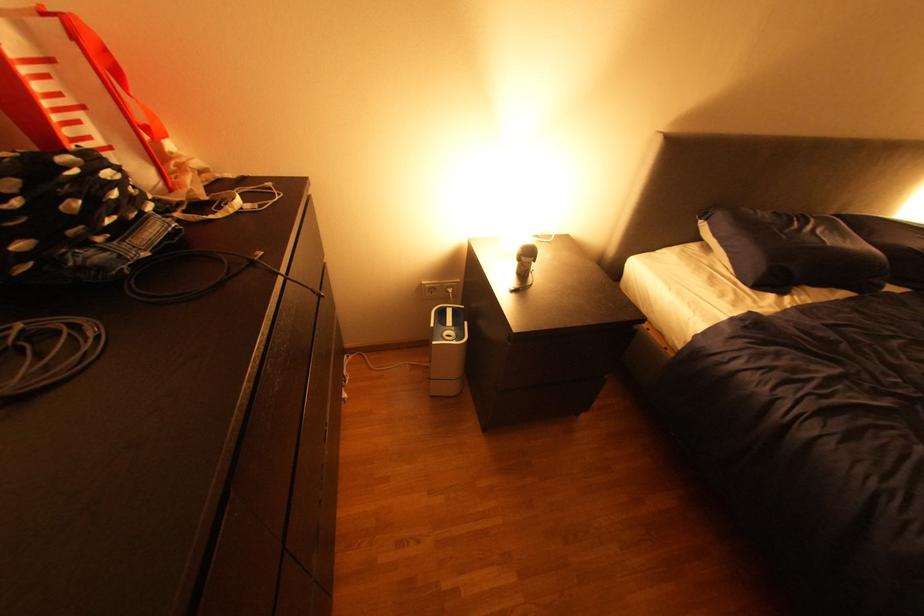
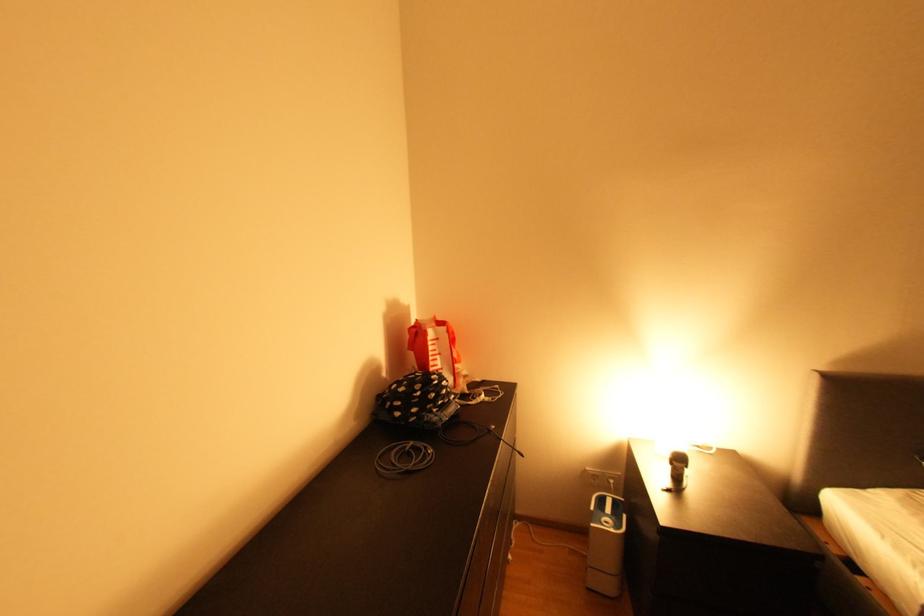
In the second image, find the point that corresponds to (x=444, y=342) in the first image.

(602, 525)